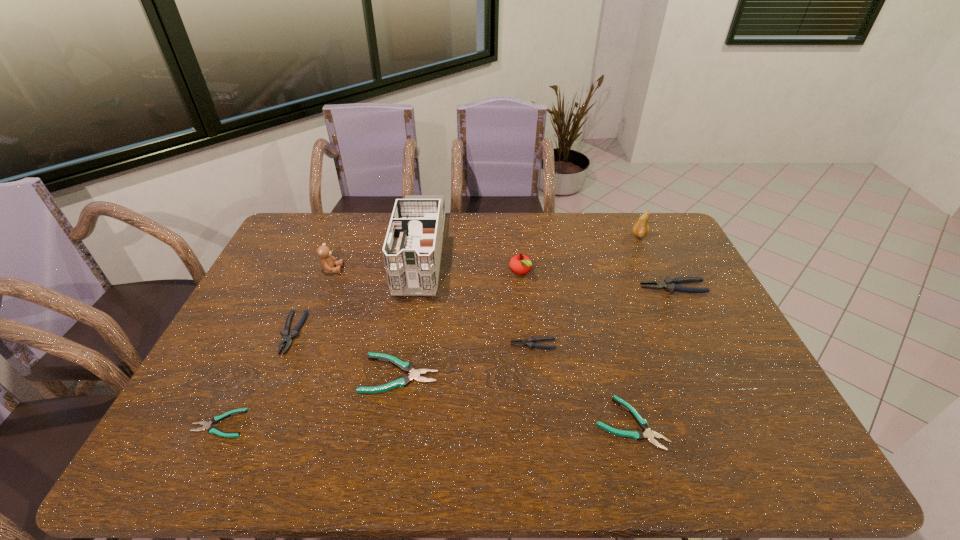
Find the location of a particular element. unoccupied position between the leftmost teal pliers and the fifth shortest object is located at coordinates (256, 379).

Locate an element on the screen. Image resolution: width=960 pixels, height=540 pixels. blank region between the second tallest pliers and the pear is located at coordinates (466, 285).

The image size is (960, 540). I want to click on the closest object relative to the teddy bear, so click(288, 335).

Select which object appears as the eighth closest to the biggest gray pliers. Please provide its 2D coordinates. Your answer should be formatted as a tuple, i.e. [(x, y)], where the tuple contains the x and y coordinates of a point satisfying the conditions above.

[(288, 335)]

Where is `pliers that stands as the fifth closest to the dollhouse`? The image size is (960, 540). pliers that stands as the fifth closest to the dollhouse is located at coordinates (637, 435).

You are a GUI agent. You are given a task and a screenshot of the screen. Output one action in this format:
    pyautogui.click(x=<x>, y=<y>)
    Task: Click on the pliers that can be found as the sixth closest to the apple
    Image resolution: width=960 pixels, height=540 pixels.
    Given the screenshot: What is the action you would take?
    pyautogui.click(x=206, y=425)

Find the location of `gray pliers that is the closest to the third object from right to left`. gray pliers that is the closest to the third object from right to left is located at coordinates (529, 342).

Locate which gray pliers ranks in proximity to the tallest object. Please provide its 2D coordinates. Your answer should be formatted as a tuple, i.e. [(x, y)], where the tuple contains the x and y coordinates of a point satisfying the conditions above.

[(288, 335)]

Select which teal pliers appears as the closest to the farthest teal pliers. Please provide its 2D coordinates. Your answer should be formatted as a tuple, i.e. [(x, y)], where the tuple contains the x and y coordinates of a point satisfying the conditions above.

[(206, 425)]

In order to click on teal pliers that is the second closest to the seventh shortest object in this screenshot , I will do `click(637, 435)`.